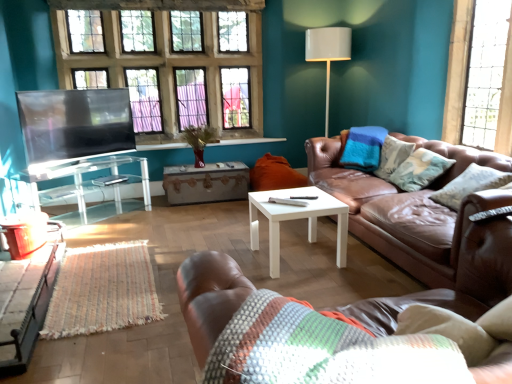
Question: From a real-world perspective, is white glossy floor lamp at upper right below clear glass windows at upper left, acting as the first window starting from the back?

Choices:
 (A) no
 (B) yes

Answer: (B)

Question: From the image's perspective, is white glossy floor lamp at upper right on top of clear glass windows at upper left, positioned as the second window in front-to-back order?

Choices:
 (A) yes
 (B) no

Answer: (B)

Question: Is white glossy floor lamp at upper right to the right of clear glass windows at upper left, acting as the first window starting from the back, from the viewer's perspective?

Choices:
 (A) no
 (B) yes

Answer: (B)

Question: Could clear glass windows at upper left, the second window when ordered from right to left, be considered to be inside white glossy floor lamp at upper right?

Choices:
 (A) no
 (B) yes

Answer: (A)

Question: Is white glossy floor lamp at upper right far from clear glass windows at upper left, acting as the first window starting from the back?

Choices:
 (A) no
 (B) yes

Answer: (B)

Question: Is brown leather couch at lower right, which is the 1th studio couch in left-to-right order, taller or shorter than textured beige pillow at right, the 1th pillow positioned from the front?

Choices:
 (A) short
 (B) tall

Answer: (A)

Question: In the image, is brown leather couch at lower right, which is the 1th studio couch in left-to-right order, on the left side or the right side of textured beige pillow at right, the 1th pillow positioned from the front?

Choices:
 (A) left
 (B) right

Answer: (A)

Question: In the image, is brown leather couch at lower right, which is counted as the 2th studio couch, starting from the right, positioned in front of or behind textured beige pillow at right, which appears as the second pillow when viewed from the back?

Choices:
 (A) behind
 (B) front

Answer: (B)

Question: From a real-world perspective, relative to textured beige pillow at right, the 1th pillow positioned from the front, is brown leather couch at lower right, which is counted as the 2th studio couch, starting from the right, vertically above or below?

Choices:
 (A) below
 (B) above

Answer: (B)

Question: Is flat matte screen at left situated inside clear glass window at upper right, the 1th window when ordered from front to back, or outside?

Choices:
 (A) outside
 (B) inside

Answer: (A)

Question: In the image, is flat matte screen at left on the left side or the right side of clear glass window at upper right, which appears as the first window when viewed from the right?

Choices:
 (A) left
 (B) right

Answer: (A)

Question: From their relative heights in the image, would you say flat matte screen at left is taller or shorter than clear glass window at upper right, which appears as the first window when viewed from the right?

Choices:
 (A) short
 (B) tall

Answer: (A)

Question: From the image's perspective, is flat matte screen at left positioned above or below clear glass window at upper right, which appears as the first window when viewed from the right?

Choices:
 (A) below
 (B) above

Answer: (A)

Question: In terms of size, does white glossy coffee table at center appear bigger or smaller than white glossy floor lamp at upper right?

Choices:
 (A) small
 (B) big

Answer: (A)

Question: Is point (271, 190) closer or farther from the camera than point (350, 49)?

Choices:
 (A) farther
 (B) closer

Answer: (B)